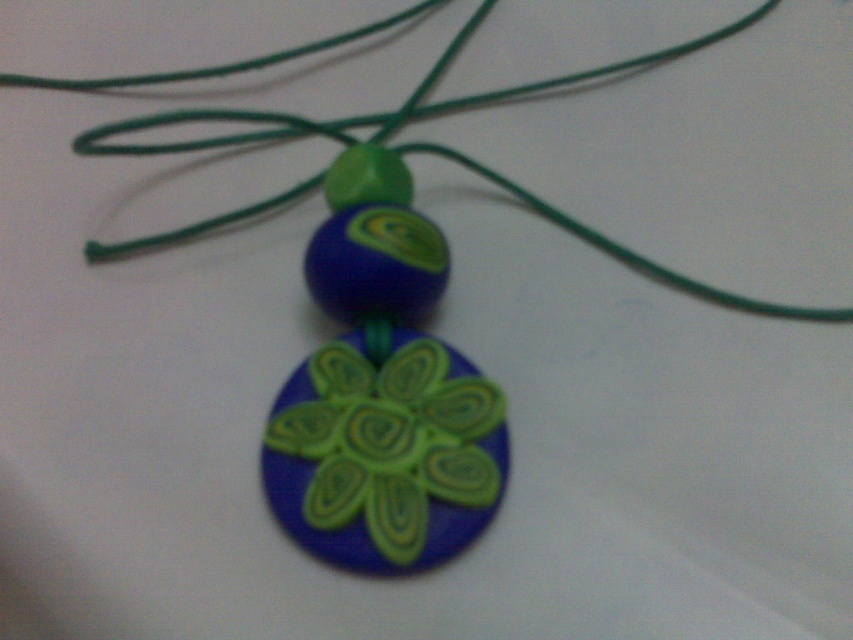
Can you confirm if matte green clay flower at center is positioned above green cord at center?

Incorrect, matte green clay flower at center is not positioned above green cord at center.

Is matte green clay flower at center taller than green cord at center?

No, matte green clay flower at center is not taller than green cord at center.

Between point (474, 470) and point (549, 216), which one is positioned in front?

Point (474, 470)

Where is `matte green clay flower at center`? matte green clay flower at center is located at coordinates (386, 454).